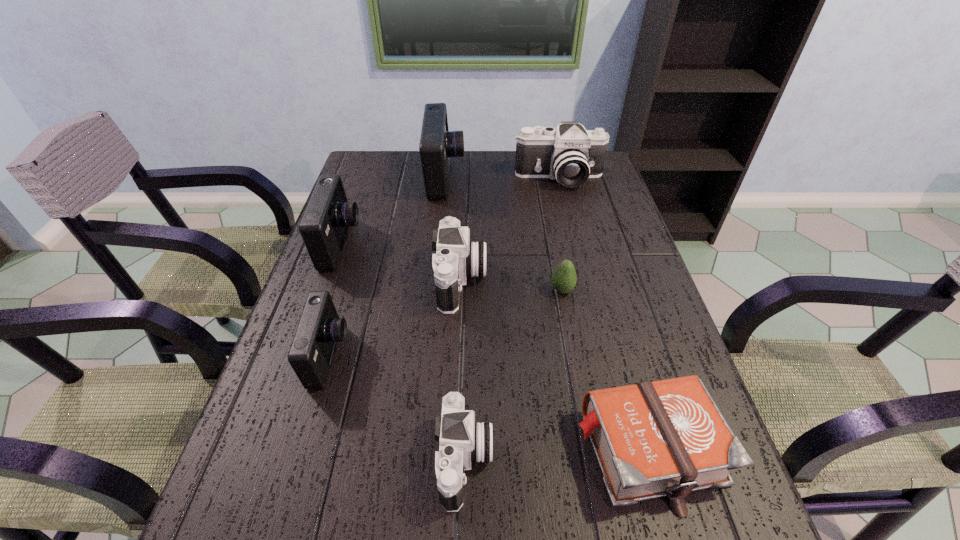
Locate an element on the screen. This screenshot has height=540, width=960. the rightmost blue camera is located at coordinates (437, 144).

The image size is (960, 540). Identify the location of the farthest blue camera. (437, 144).

Identify the location of the rightmost black camera. (570, 154).

The height and width of the screenshot is (540, 960). Find the location of `the biggest black camera`. the biggest black camera is located at coordinates (570, 154).

Identify the location of the second nearest blue camera. (325, 223).

The height and width of the screenshot is (540, 960). I want to click on the second biggest black camera, so click(456, 258).

At what (x,y) coordinates should I click in order to perform the action: click on the fifth farthest camera. Please return your answer as a coordinate pair (x, y). The width and height of the screenshot is (960, 540). Looking at the image, I should click on (310, 356).

The image size is (960, 540). I want to click on the nearest blue camera, so click(310, 356).

The width and height of the screenshot is (960, 540). In order to click on the smallest black camera in this screenshot , I will do `click(462, 440)`.

Where is `the nearest black camera`? This screenshot has height=540, width=960. the nearest black camera is located at coordinates (462, 440).